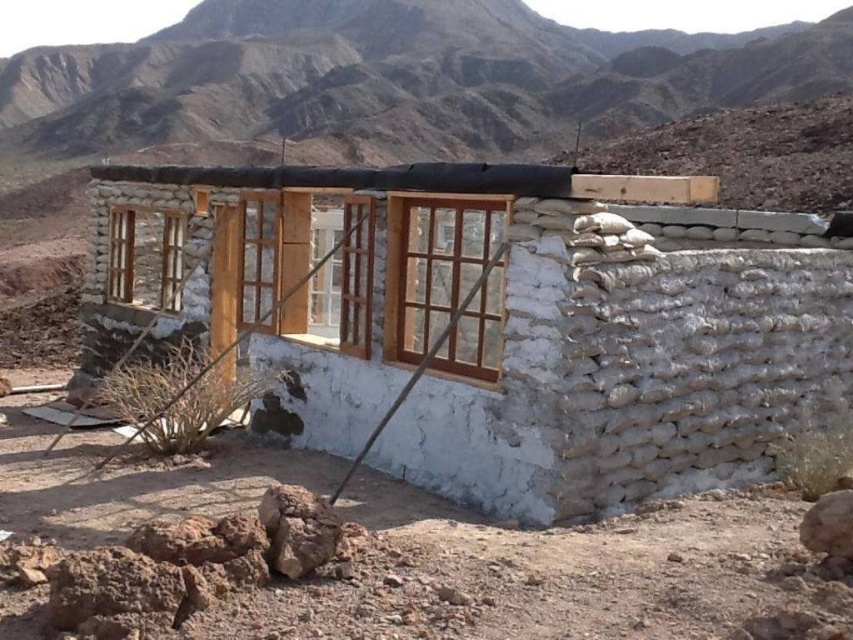
Question: Which is farther from the white stucco hut at center?

Choices:
 (A) wooden frame at center
 (B) wooden frame at left

Answer: (B)

Question: Does brown rocky mountain at upper center appear on the right side of wooden frame at left?

Choices:
 (A) yes
 (B) no

Answer: (A)

Question: Which of the following is the farthest from the observer?

Choices:
 (A) wooden frame at left
 (B) wooden frame at center

Answer: (A)

Question: Considering the real-world distances, which object is closest to the white stucco hut at center?

Choices:
 (A) wooden frame at center
 (B) wooden-framed glass window at center

Answer: (B)

Question: Observing the image, what is the correct spatial positioning of brown rocky mountain at upper center in reference to wooden frame at left?

Choices:
 (A) left
 (B) right

Answer: (B)

Question: Can you confirm if white stucco hut at center is smaller than wooden frame at center?

Choices:
 (A) no
 (B) yes

Answer: (B)